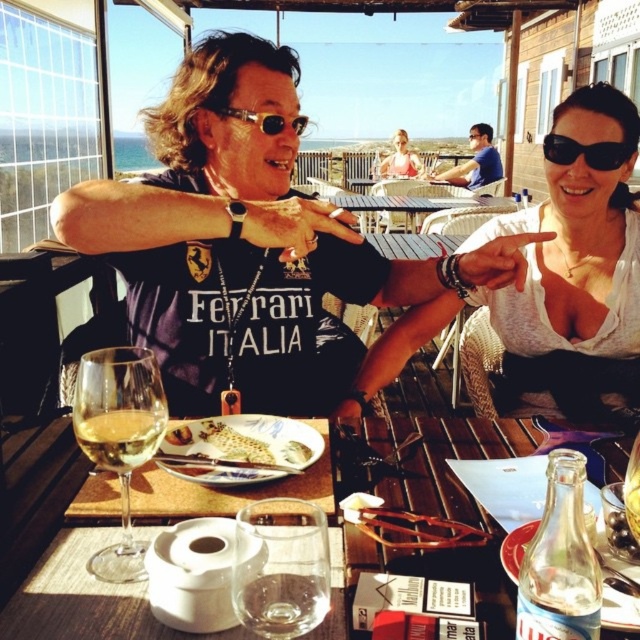
You are a server at the restaurant and need to choose a glass for a customer who prefers taller drinks. Which glass should you select between the translucent glass wine at lower left and the transparent glass at table center?

The translucent glass wine at lower left has a greater height compared to the transparent glass at table center, so you should choose the translucent glass wine at lower left for the taller drink.

You are a customer at this seaside restaurant and want to order a drink. The waiter tells you that the drink will be placed on the clear glass table at center. However, you notice a white glossy fish at center in the image. Could this fish interfere with placing the drink on the table?

The clear glass table at center is below the white glossy fish at center, so the fish is not on the table itself and will not interfere with placing the drink there.

You are a waiter at the seaside restaurant. You need to place a new menu on the table that is exactly the same size as the white glossy fish at center. Is the clear glass table at center large enough to accommodate the menu?

The clear glass table at center is bigger than the white glossy fish at center, so yes, the table can accommodate the menu since it is larger than the fish.